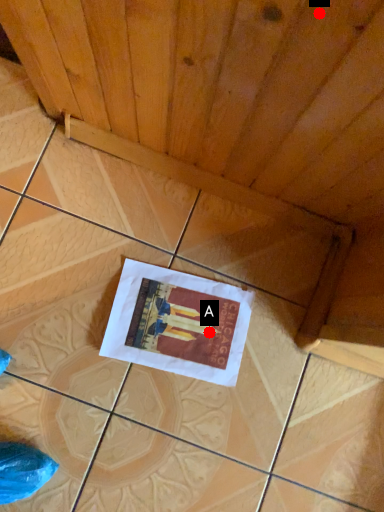
Question: Two points are circled on the image, labeled by A and B beside each circle. Which point is farther to the camera?

Choices:
 (A) A is further
 (B) B is further

Answer: (A)